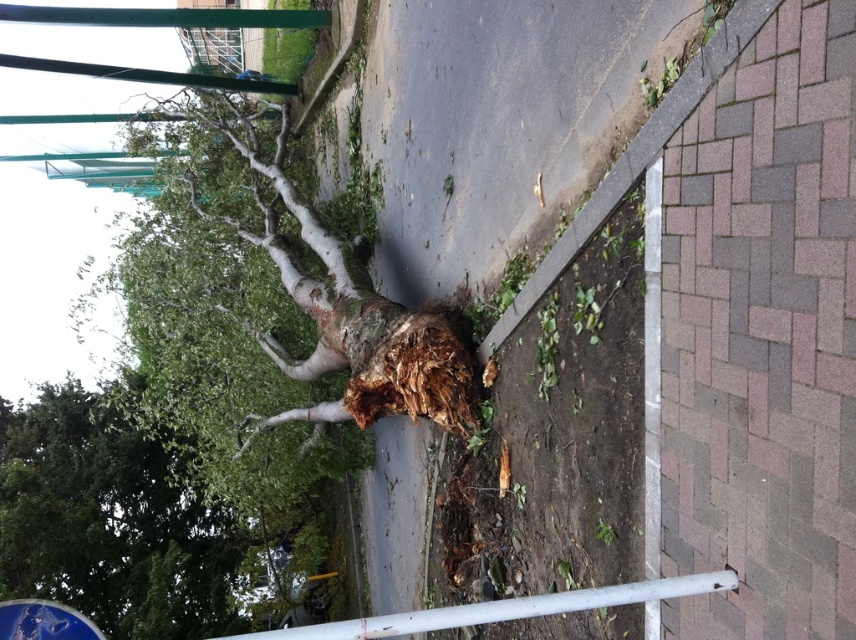
Who is higher up, green leafy tree at lower left or blue glossy street sign at lower left?

blue glossy street sign at lower left

Between green leafy tree at lower left and blue glossy street sign at lower left, which one appears on the left side from the viewer's perspective?

From the viewer's perspective, green leafy tree at lower left appears more on the left side.

Identify the location of green leafy tree at lower left. (108, 522).

From the picture: Does white matte rail at lower center appear under blue glossy street sign at lower left?

Incorrect, white matte rail at lower center is not positioned below blue glossy street sign at lower left.

How much distance is there between white matte rail at lower center and blue glossy street sign at lower left?

A distance of 2.70 meters exists between white matte rail at lower center and blue glossy street sign at lower left.

Where is `white matte rail at lower center`? The width and height of the screenshot is (856, 640). white matte rail at lower center is located at coordinates (504, 609).

Can you confirm if green leafy tree at lower left is positioned below white matte rail at lower center?

Correct, green leafy tree at lower left is located below white matte rail at lower center.

Between green leafy tree at lower left and white matte rail at lower center, which one appears on the left side from the viewer's perspective?

Positioned to the left is green leafy tree at lower left.

Is point (105, 460) closer to viewer compared to point (571, 605)?

No.

The height and width of the screenshot is (640, 856). I want to click on green leafy tree at lower left, so click(x=108, y=522).